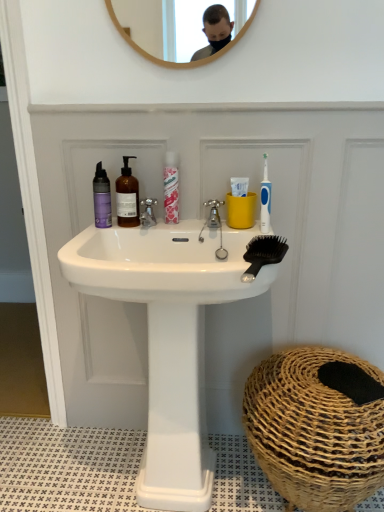
Question: Is blue plastic toothbrush at upper right wider or thinner than black plastic comb at upper right?

Choices:
 (A) thin
 (B) wide

Answer: (A)

Question: Is blue plastic toothbrush at upper right inside or outside of black plastic comb at upper right?

Choices:
 (A) outside
 (B) inside

Answer: (A)

Question: Which object is the farthest from the white glossy sink at center?

Choices:
 (A) translucent amber bottle at center, acting as the 2th mouthwash starting from the left
 (B) pink glossy mouthwash at center, which appears as the 1th mouthwash when viewed from the right
 (C) silver metallic tap at center, the 2th tap positioned from the left
 (D) blue plastic toothbrush at upper right
 (E) brown woven basket at lower right

Answer: (D)

Question: Which of these objects is positioned farthest from the white glossy sink at center?

Choices:
 (A) blue plastic toothbrush at upper right
 (B) black plastic comb at upper right
 (C) purple matte bottle at left, which is the first mouthwash in left-to-right order
 (D) brown woven basket at lower right
 (E) silver metallic tap at center, the 2th tap positioned from the left

Answer: (A)